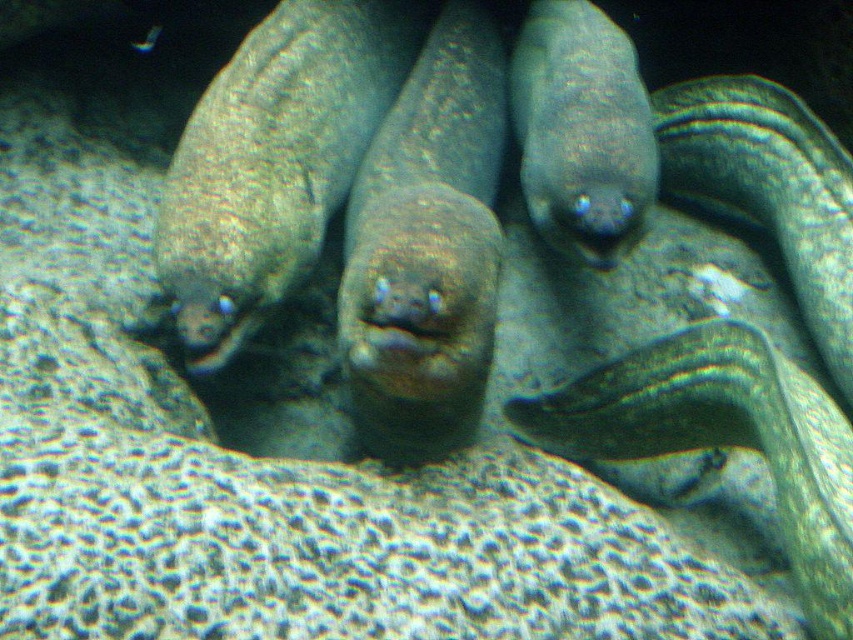
Question: Among these objects, which one is nearest to the camera?

Choices:
 (A) green textured snake at right
 (B) green striped eel at center
 (C) slick green eel at center
 (D) shiny brown eel at center

Answer: (B)

Question: Which point is farther to the camera?

Choices:
 (A) shiny brown eel at center
 (B) sandy brown skin at center

Answer: (A)

Question: Which point appears farthest from the camera in this image?

Choices:
 (A) (251, 186)
 (B) (490, 228)
 (C) (572, 164)

Answer: (A)

Question: From the image, what is the correct spatial relationship of green striped eel at center in relation to slick green eel at center?

Choices:
 (A) left
 (B) right

Answer: (B)

Question: Does green textured snake at right appear on the right side of slick green eel at center?

Choices:
 (A) yes
 (B) no

Answer: (A)

Question: Does shiny brown eel at center have a greater width compared to slick green eel at center?

Choices:
 (A) yes
 (B) no

Answer: (A)